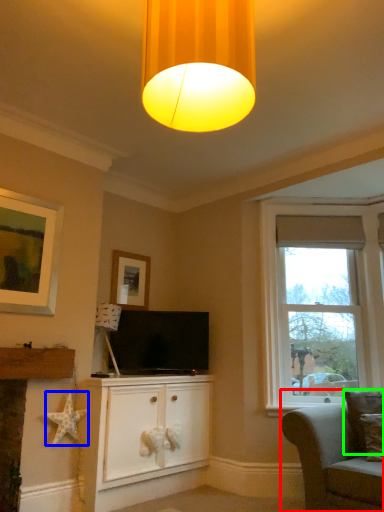
Question: Which is farther away from studio couch (highlighted by a red box)? star (highlighted by a blue box) or pillow (highlighted by a green box)?

Choices:
 (A) star
 (B) pillow

Answer: (A)